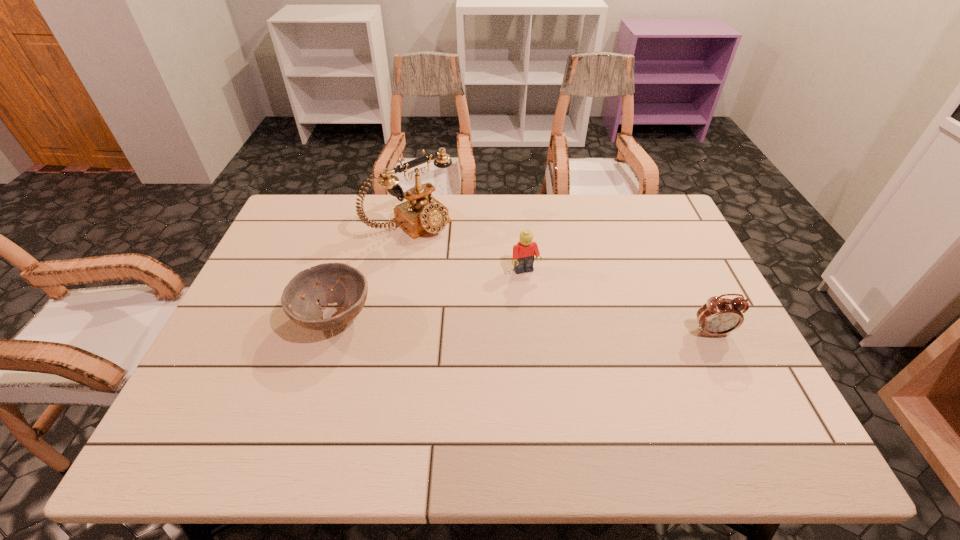
At what (x,y) coordinates should I click in order to perform the action: click on the shortest object. Please return your answer as a coordinate pair (x, y). Looking at the image, I should click on (350, 287).

Identify the location of the rightmost object. This screenshot has height=540, width=960. (718, 316).

You are a GUI agent. You are given a task and a screenshot of the screen. Output one action in this format:
    pyautogui.click(x=<x>, y=<y>)
    Task: Click on the telephone
    This screenshot has height=540, width=960.
    Given the screenshot: What is the action you would take?
    pyautogui.click(x=421, y=214)

You are a GUI agent. You are given a task and a screenshot of the screen. Output one action in this format:
    pyautogui.click(x=<x>, y=<y>)
    Task: Click on the farthest object
    This screenshot has height=540, width=960.
    Given the screenshot: What is the action you would take?
    click(421, 214)

You are a GUI agent. You are given a task and a screenshot of the screen. Output one action in this format:
    pyautogui.click(x=<x>, y=<y>)
    Task: Click on the Lego
    
    Given the screenshot: What is the action you would take?
    pyautogui.click(x=523, y=253)

Find the location of a particular element. The height and width of the screenshot is (540, 960). the third object from left to right is located at coordinates (523, 253).

Where is `vacant region located on the back of the shortest object`? vacant region located on the back of the shortest object is located at coordinates (364, 221).

The image size is (960, 540). In order to click on free spot located 0.160m on the face of the alarm clock in this screenshot , I will do `click(743, 396)`.

You are a GUI agent. You are given a task and a screenshot of the screen. Output one action in this format:
    pyautogui.click(x=<x>, y=<y>)
    Task: Click on the free space located 0.190m on the dial number of the tallest object
    The width and height of the screenshot is (960, 540).
    Given the screenshot: What is the action you would take?
    pyautogui.click(x=475, y=273)

Locate an element on the screen. This screenshot has height=540, width=960. blank space located 0.250m on the dial number of the tallest object is located at coordinates (489, 285).